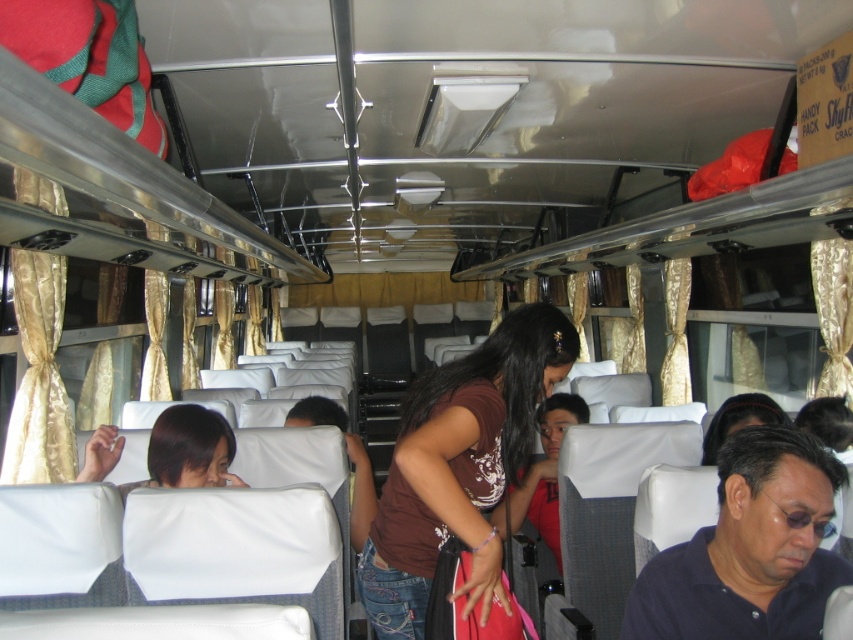
Does brown matte shirt at center have a greater width compared to brown fabric shirt at center?

Correct, the width of brown matte shirt at center exceeds that of brown fabric shirt at center.

Can you confirm if brown matte shirt at center is thinner than brown fabric shirt at center?

No.

Is point (390, 573) less distant than point (585, 412)?

Yes, point (390, 573) is closer to viewer.

The image size is (853, 640). In order to click on brown matte shirt at center in this screenshot , I will do `click(459, 467)`.

Can you confirm if dark blue shirt at lower right is positioned to the left of brown fabric shirt at center?

In fact, dark blue shirt at lower right is to the right of brown fabric shirt at center.

Which is in front, point (796, 490) or point (578, 410)?

Point (796, 490) is more forward.

In order to click on dark blue shirt at lower right in this screenshot , I will do `click(750, 548)`.

Is brown matte shirt at center to the right of dark blue shirt at lower right from the viewer's perspective?

No, brown matte shirt at center is not to the right of dark blue shirt at lower right.

Is brown matte shirt at center positioned in front of dark blue shirt at lower right?

No, brown matte shirt at center is further to the viewer.

This screenshot has height=640, width=853. I want to click on brown matte shirt at center, so coord(459,467).

The height and width of the screenshot is (640, 853). I want to click on brown matte shirt at center, so pos(459,467).